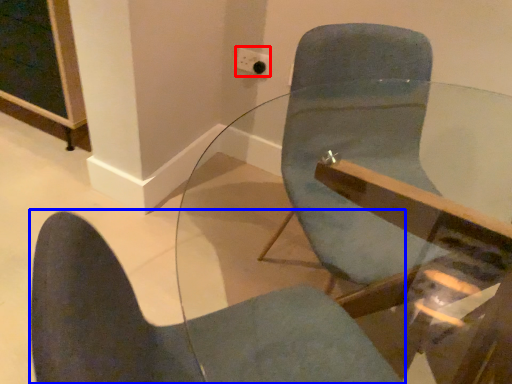
Question: Which object is further to the camera taking this photo, electric outlet (highlighted by a red box) or chair (highlighted by a blue box)?

Choices:
 (A) electric outlet
 (B) chair

Answer: (A)